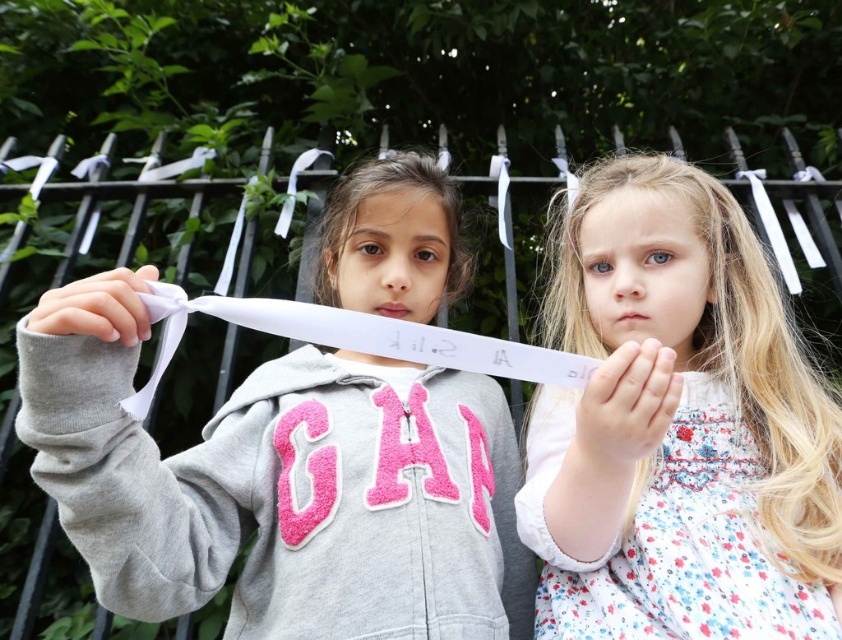
This screenshot has width=842, height=640. What are the coordinates of `gray fleece hoodie at center` in the screenshot? It's located at (280, 484).

Is gray fleece hoodie at center below white floral dress at center?

Yes, gray fleece hoodie at center is below white floral dress at center.

Locate an element on the screen. This screenshot has height=640, width=842. gray fleece hoodie at center is located at coordinates (280, 484).